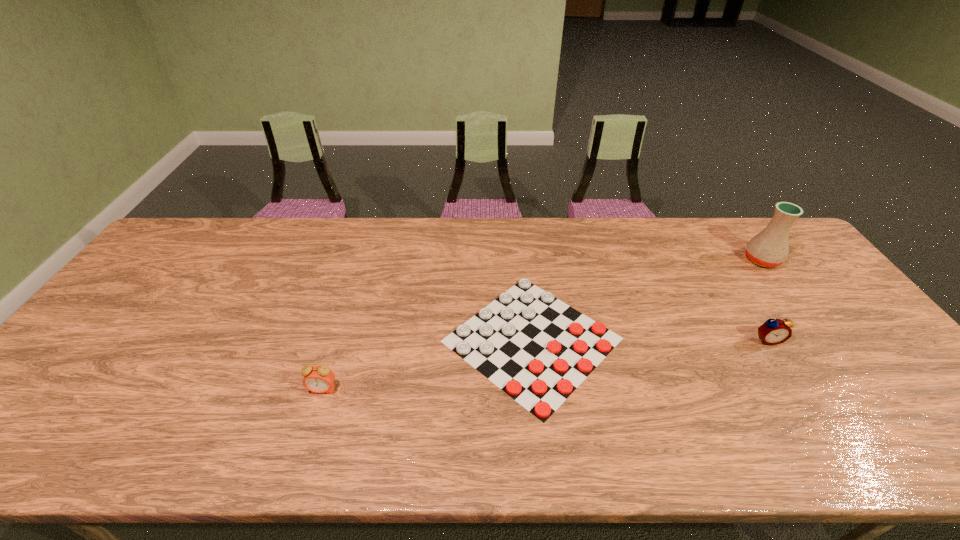
You are a GUI agent. You are given a task and a screenshot of the screen. Output one action in this format:
    pyautogui.click(x=<x>, y=<y>)
    Task: Click on the vacant area located on the front-facing side of the farther alarm clock
    This screenshot has width=960, height=540.
    Given the screenshot: What is the action you would take?
    pyautogui.click(x=825, y=431)

In order to click on blank area located 0.090m on the left of the checkerboard in this screenshot , I will do `click(406, 340)`.

The height and width of the screenshot is (540, 960). I want to click on object that is at the far edge, so click(x=769, y=248).

At what (x,y) coordinates should I click in order to perform the action: click on object present at the right edge. Please return your answer as a coordinate pair (x, y). This screenshot has height=540, width=960. Looking at the image, I should click on (769, 248).

I want to click on object that is positioned at the far right corner, so click(x=769, y=248).

Where is `vacant space at the far edge`? This screenshot has height=540, width=960. vacant space at the far edge is located at coordinates (372, 232).

In the image, there is a desktop. Identify the location of vacant space at the near edge. (246, 427).

Identify the location of free spot at the left edge of the desktop. (38, 396).

The image size is (960, 540). I want to click on free spot at the right edge of the desktop, so click(828, 320).

Locate an element on the screen. The width and height of the screenshot is (960, 540). free region at the far left corner is located at coordinates (196, 246).